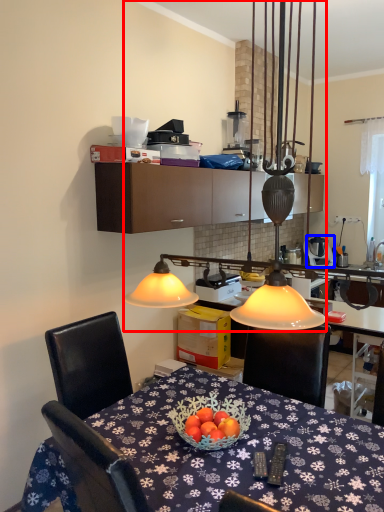
Question: Which point is closer to the camera, lamp (highlighted by a red box) or appliance (highlighted by a blue box)?

Choices:
 (A) lamp
 (B) appliance

Answer: (A)